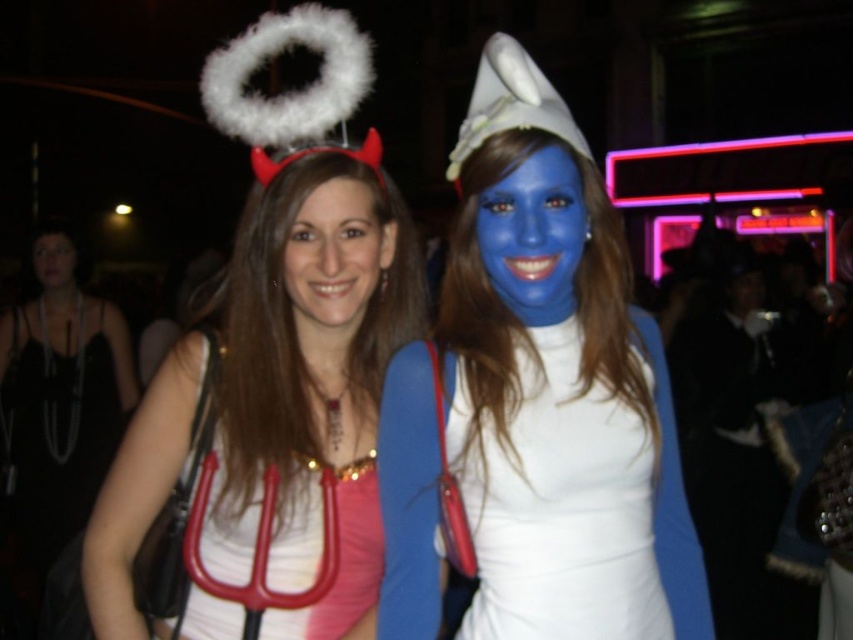
Question: Does pink fabric dress at center lie in front of blue matte face at center?

Choices:
 (A) yes
 (B) no

Answer: (B)

Question: From the image, what is the correct spatial relationship of white matte halo at upper center in relation to pink fabric dress at center?

Choices:
 (A) below
 (B) above

Answer: (B)

Question: Which object is closer to the camera taking this photo?

Choices:
 (A) white matte halo at upper center
 (B) matte black face at center

Answer: (A)

Question: Which object is closer to the camera taking this photo?

Choices:
 (A) pink fabric dress at center
 (B) white matte halo at upper center
 (C) blue matte/soft skin at center

Answer: (C)

Question: Among these objects, which one is nearest to the camera?

Choices:
 (A) blue matte/soft skin at center
 (B) blue matte face at center

Answer: (A)

Question: Does pink fabric dress at center appear over matte white face at center?

Choices:
 (A) yes
 (B) no

Answer: (B)